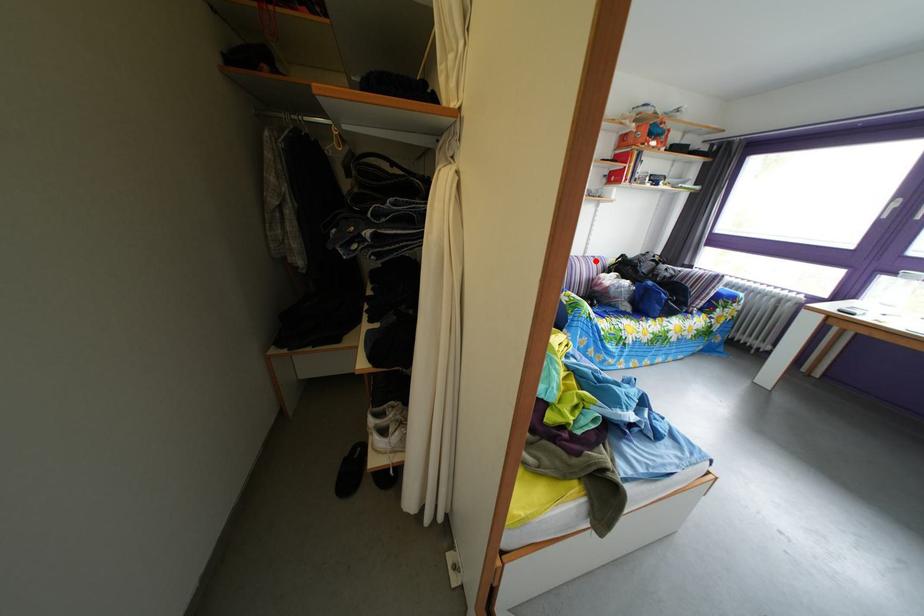
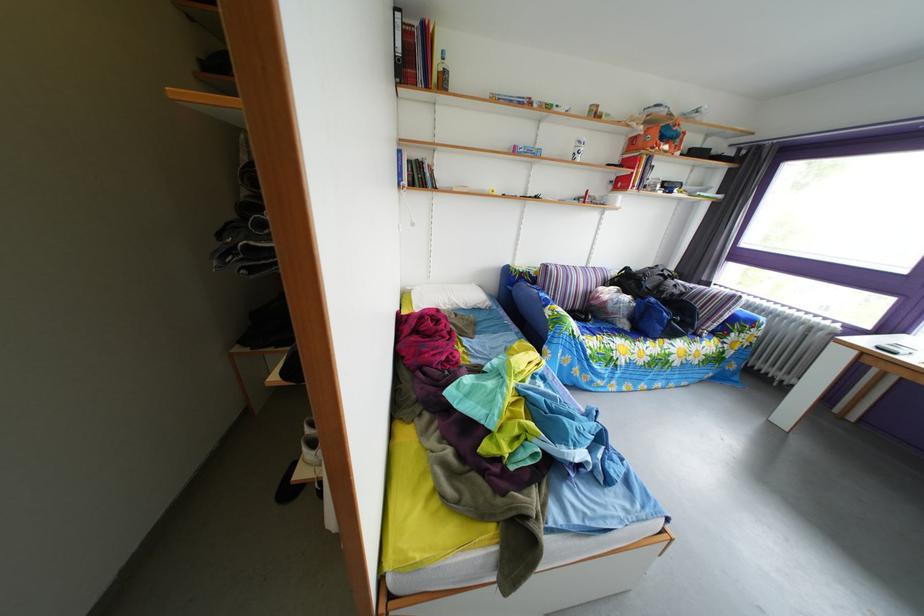
Where in the second image is the point corresponding to the highlighted location from the first image?

(599, 270)